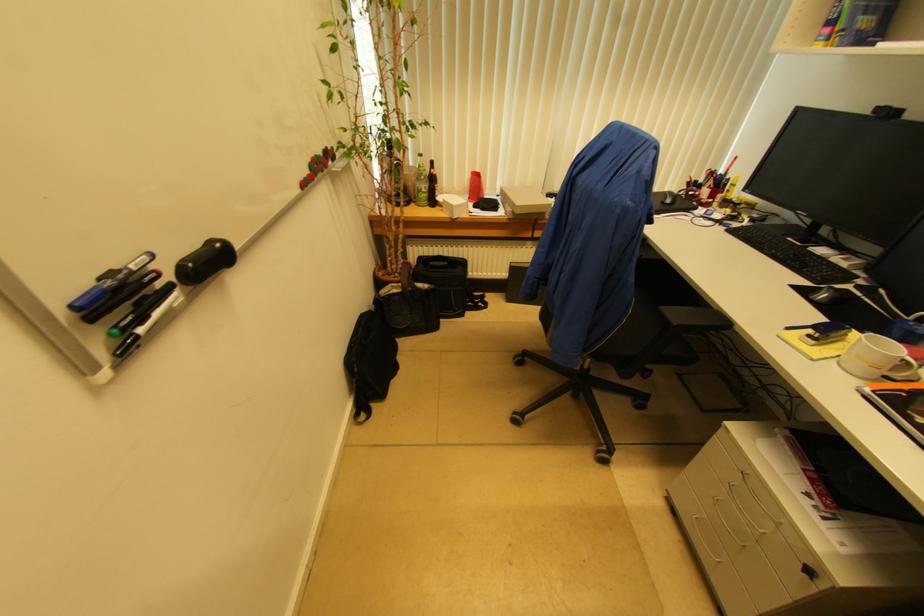
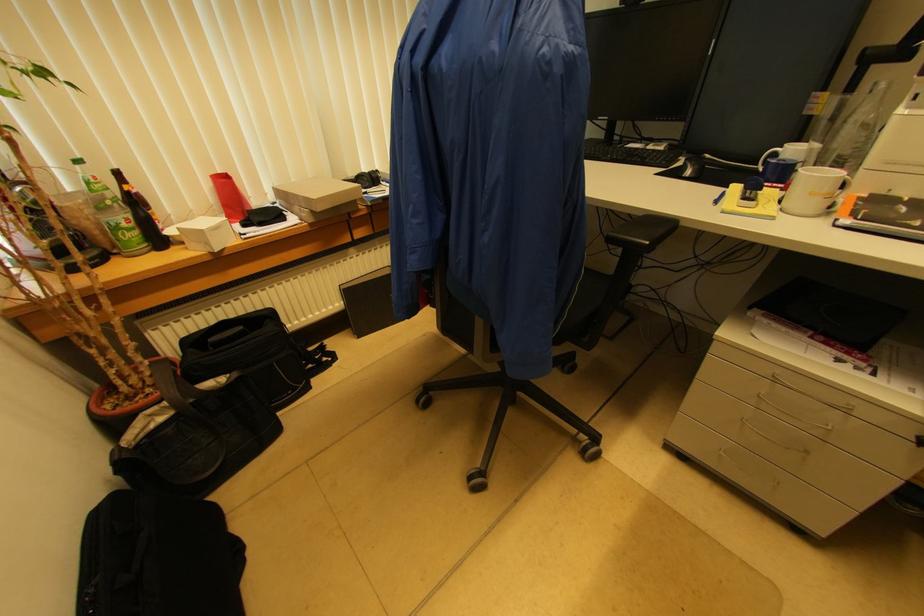
Where in the second image is the point corresponding to pixel 429 188 from the first image?

(131, 219)